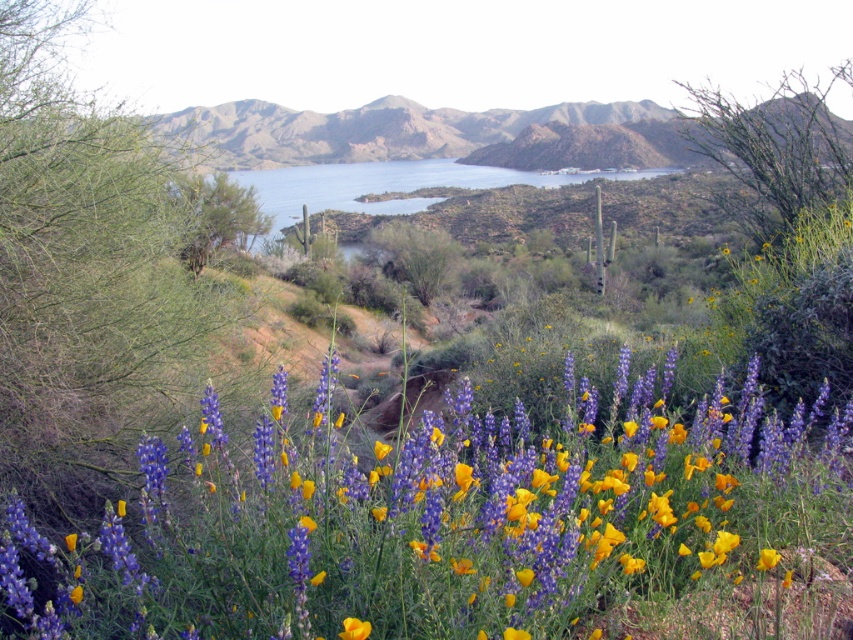
You are a botanist examining the desert landscape. You notice the vibrant purple petals at center and the yellow matte flower at lower center. Which of these two flowers is positioned closer to your viewpoint?

The vibrant purple petals at center are closer to the viewer than the yellow matte flower at lower center.

You are a hiker in the desert and you see the vibrant purple petals at center and the blue water at center. How far apart are these two landmarks from each other?

The vibrant purple petals at center is 60.26 meters away from blue water at center.

You are standing at the origin point of the coordinate system in the desert scene. The vibrant purple petals at center are located at coordinates point 0.814, 0.533. If you want to reach them, which direction should you move in?

The vibrant purple petals at center are located at coordinates point (454,520), so you should move northeast to reach them.